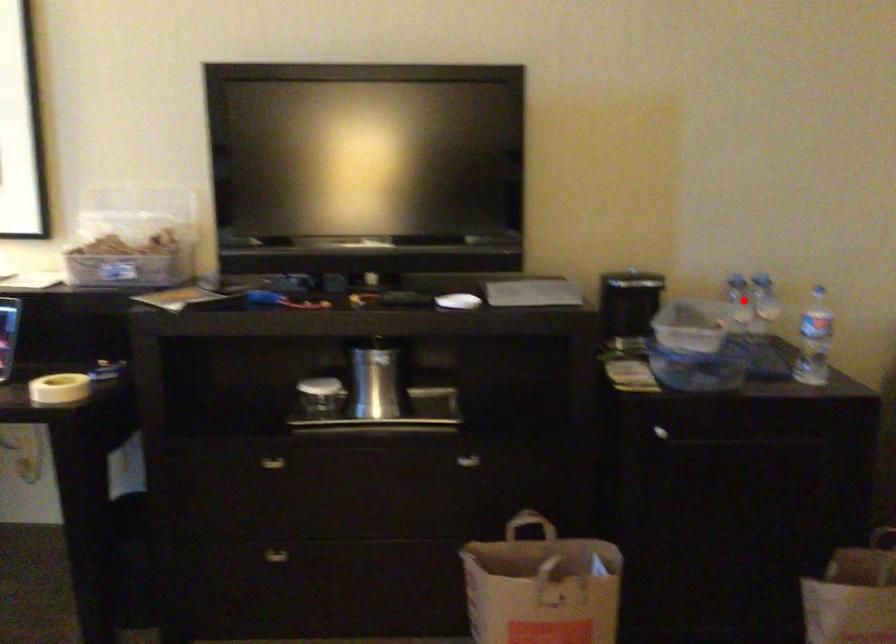
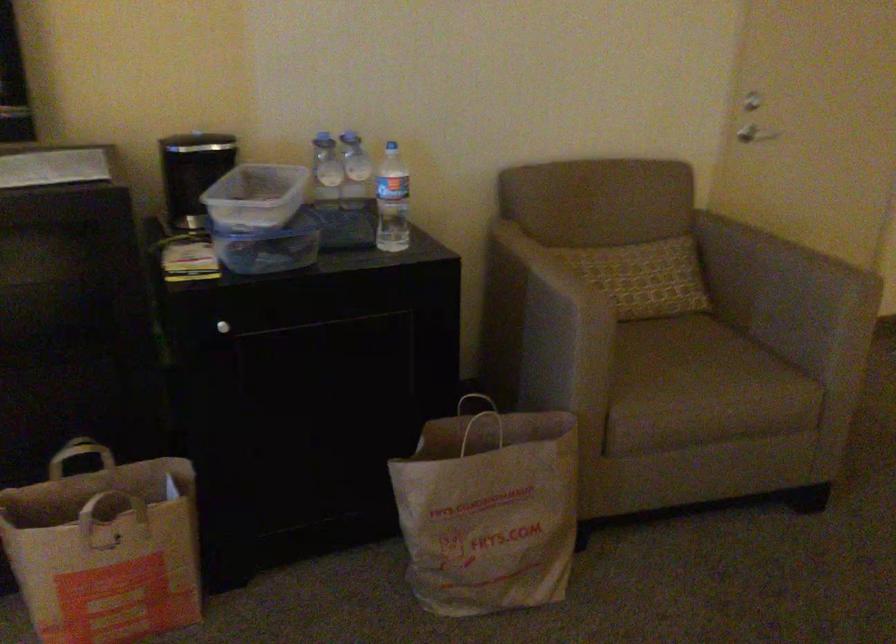
Question: I am providing you with two images of the same scene from different viewpoints. Given a red point in image1, look at the same physical point in image2. Is it:

Choices:
 (A) Closer to the viewpoint
 (B) Farther from the viewpoint

Answer: (A)